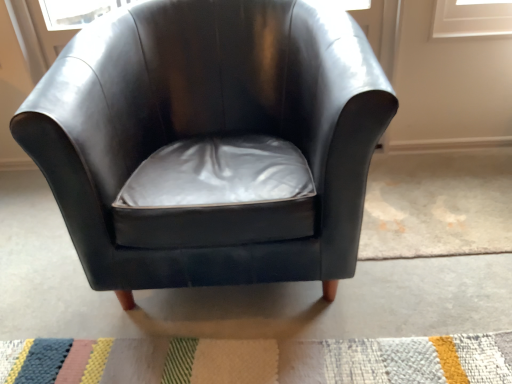
Identify the location of glossy leather chair at center. The width and height of the screenshot is (512, 384). (209, 129).

Measure the distance between glossy leather chair at center and camera.

glossy leather chair at center is 32.90 inches from camera.

What do you see at coordinates (209, 129) in the screenshot?
I see `glossy leather chair at center` at bounding box center [209, 129].

The height and width of the screenshot is (384, 512). What do you see at coordinates (260, 360) in the screenshot?
I see `multicolored woven mat at lower center` at bounding box center [260, 360].

Find the location of a particular element. The image size is (512, 384). multicolored woven mat at lower center is located at coordinates (260, 360).

Image resolution: width=512 pixels, height=384 pixels. I want to click on glossy leather chair at center, so click(209, 129).

Considering the relative positions of glossy leather chair at center and multicolored woven mat at lower center in the image provided, is glossy leather chair at center to the right of multicolored woven mat at lower center from the viewer's perspective?

In fact, glossy leather chair at center is to the left of multicolored woven mat at lower center.

Which object is more forward, glossy leather chair at center or multicolored woven mat at lower center?

glossy leather chair at center is more forward.

Does point (260, 101) appear closer or farther from the camera than point (481, 348)?

Point (260, 101) is farther from the camera than point (481, 348).

From the image's perspective, which one is positioned higher, glossy leather chair at center or multicolored woven mat at lower center?

glossy leather chair at center.

From a real-world perspective, between glossy leather chair at center and multicolored woven mat at lower center, who is vertically lower?

multicolored woven mat at lower center is physically lower.

Based on the photo, can you confirm if glossy leather chair at center is thinner than multicolored woven mat at lower center?

Yes, glossy leather chair at center is thinner than multicolored woven mat at lower center.

Who is shorter, glossy leather chair at center or multicolored woven mat at lower center?

With less height is multicolored woven mat at lower center.

Which of these two, glossy leather chair at center or multicolored woven mat at lower center, is bigger?

glossy leather chair at center.

Is multicolored woven mat at lower center located within glossy leather chair at center?

No.

Is the surface of glossy leather chair at center in direct contact with multicolored woven mat at lower center?

No, glossy leather chair at center is not touching multicolored woven mat at lower center.

Based on the photo, is glossy leather chair at center turned away from multicolored woven mat at lower center?

No.

How different are the orientations of glossy leather chair at center and multicolored woven mat at lower center in degrees?

glossy leather chair at center and multicolored woven mat at lower center are facing 88.3 degrees away from each other.

How far apart are glossy leather chair at center and multicolored woven mat at lower center?

glossy leather chair at center and multicolored woven mat at lower center are 20.69 inches apart from each other.

Identify the location of doormat below the glossy leather chair at center (from a real-world perspective). Image resolution: width=512 pixels, height=384 pixels. (260, 360).

Can you confirm if multicolored woven mat at lower center is positioned to the right of glossy leather chair at center?

Correct, you'll find multicolored woven mat at lower center to the right of glossy leather chair at center.

Considering the relative positions of multicolored woven mat at lower center and glossy leather chair at center in the image provided, is multicolored woven mat at lower center in front of glossy leather chair at center?

No, the depth of multicolored woven mat at lower center is greater than that of glossy leather chair at center.

Which is behind, point (72, 355) or point (93, 29)?

Point (93, 29)

From the image's perspective, relative to glossy leather chair at center, is multicolored woven mat at lower center above or below?

Based on their image positions, multicolored woven mat at lower center is located beneath glossy leather chair at center.

From a real-world perspective, between multicolored woven mat at lower center and glossy leather chair at center, who is vertically lower?

From a 3D spatial view, multicolored woven mat at lower center is below.

Considering the sizes of objects multicolored woven mat at lower center and glossy leather chair at center in the image provided, who is wider, multicolored woven mat at lower center or glossy leather chair at center?

Wider between the two is multicolored woven mat at lower center.

Is multicolored woven mat at lower center shorter than glossy leather chair at center?

Yes.

Based on their sizes in the image, would you say multicolored woven mat at lower center is bigger or smaller than glossy leather chair at center?

Clearly, multicolored woven mat at lower center is smaller in size than glossy leather chair at center.

Choose the correct answer: Is multicolored woven mat at lower center inside glossy leather chair at center or outside it?

multicolored woven mat at lower center cannot be found inside glossy leather chair at center.

Is multicolored woven mat at lower center not near glossy leather chair at center?

That's not correct — multicolored woven mat at lower center is a little close to glossy leather chair at center.

Is multicolored woven mat at lower center turned away from glossy leather chair at center?

multicolored woven mat at lower center is not turned away from glossy leather chair at center.

In the scene shown: How much distance is there between multicolored woven mat at lower center and glossy leather chair at center?

A distance of 52.55 centimeters exists between multicolored woven mat at lower center and glossy leather chair at center.

I want to click on doormat below the glossy leather chair at center (from a real-world perspective), so click(x=260, y=360).

At what (x,y) coordinates should I click in order to perform the action: click on chair in front of the multicolored woven mat at lower center. Please return your answer as a coordinate pair (x, y). Looking at the image, I should click on (209, 129).

At what (x,y) coordinates should I click in order to perform the action: click on chair above the multicolored woven mat at lower center (from a real-world perspective). Please return your answer as a coordinate pair (x, y). The image size is (512, 384). Looking at the image, I should click on (209, 129).